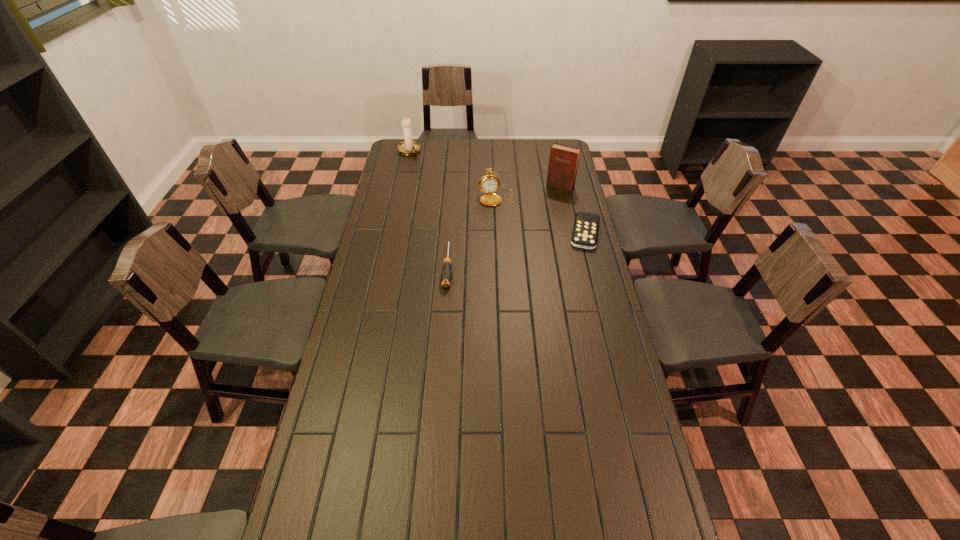
I want to click on screwdriver, so click(x=446, y=276).

I want to click on the second shortest object, so click(x=446, y=276).

In order to click on remote control in this screenshot , I will do `click(586, 225)`.

Where is `diary`? This screenshot has width=960, height=540. diary is located at coordinates (563, 162).

Where is `pocket watch`? The width and height of the screenshot is (960, 540). pocket watch is located at coordinates (488, 184).

Identify the location of the third shortest object. The width and height of the screenshot is (960, 540). (488, 184).

Find the location of a particular element. This screenshot has width=960, height=540. candle holder is located at coordinates (409, 147).

The image size is (960, 540). I want to click on the leftmost object, so tap(409, 147).

Image resolution: width=960 pixels, height=540 pixels. What are the coordinates of `vacant space located at the tip of the screwdriver` in the screenshot? It's located at (441, 366).

The width and height of the screenshot is (960, 540). I want to click on vacant space located on the back of the remote control, so click(573, 187).